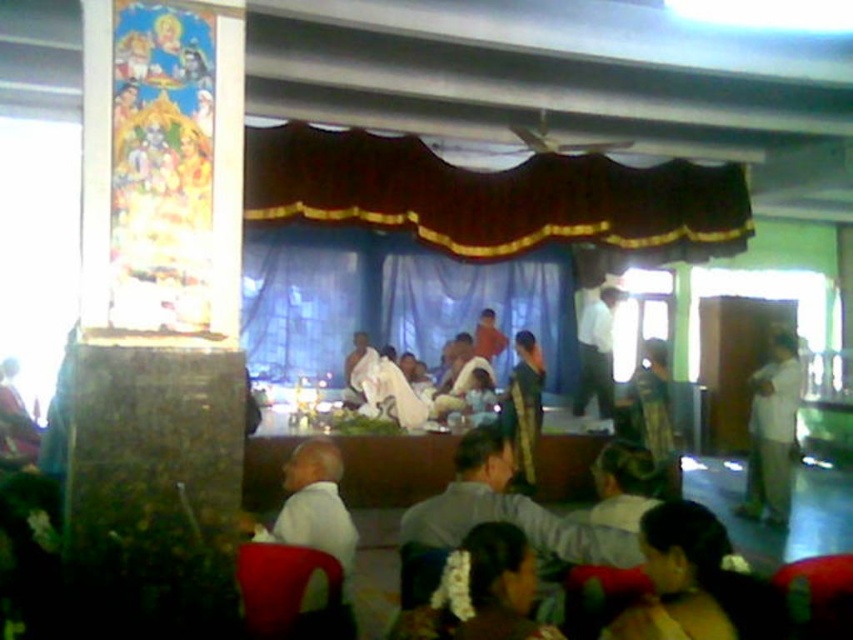
Can you confirm if blue fabric curtain at center is positioned below white cloth at right?

Incorrect, blue fabric curtain at center is not positioned below white cloth at right.

The height and width of the screenshot is (640, 853). Describe the element at coordinates (480, 307) in the screenshot. I see `blue fabric curtain at center` at that location.

This screenshot has height=640, width=853. Find the location of `blue fabric curtain at center`. blue fabric curtain at center is located at coordinates (480, 307).

From the picture: Which of these two, blue fabric curtain at center or white matte shirt at lower left, stands taller?

Standing taller between the two is blue fabric curtain at center.

Where is `blue fabric curtain at center`? blue fabric curtain at center is located at coordinates (480, 307).

Does blue fabric curtain at center have a greater width compared to silk-like golden robe at center?

Yes.

Is point (445, 257) farther from viewer compared to point (508, 401)?

Yes, point (445, 257) is farther from viewer.

Does point (383, 289) come in front of point (532, 448)?

No, (383, 289) is behind (532, 448).

You are a GUI agent. You are given a task and a screenshot of the screen. Output one action in this format:
    pyautogui.click(x=<x>, y=<y>)
    Task: Click on the blue fabric curtain at center
    
    Given the screenshot: What is the action you would take?
    pyautogui.click(x=480, y=307)